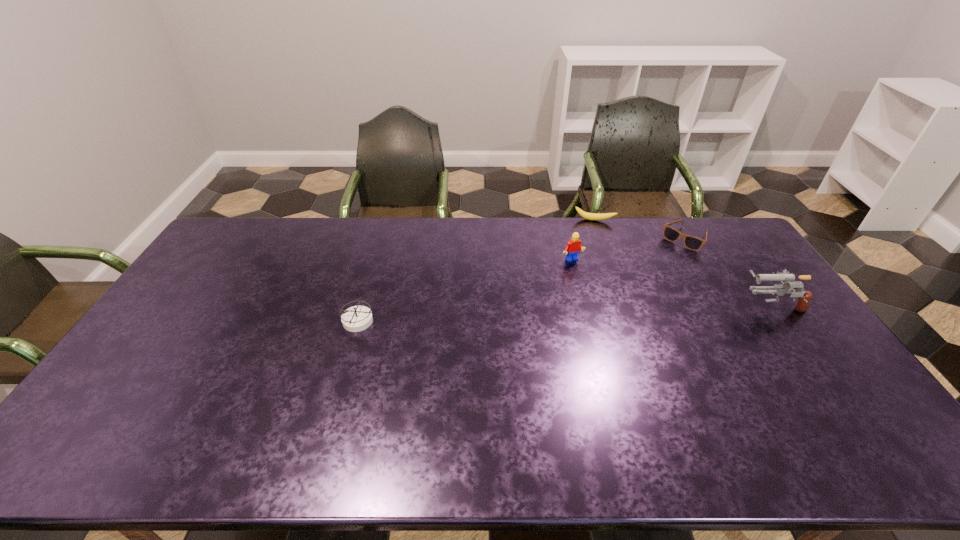
Identify which object is the closest to the compass. Please provide its 2D coordinates. Your answer should be formatted as a tuple, i.e. [(x, y)], where the tuple contains the x and y coordinates of a point satisfying the conditions above.

[(573, 247)]

Locate an element on the screen. free space in the image that satisfies the following two spatial constraints: 1. on the front side of the Lego; 2. at the barrel end of the gun is located at coordinates (584, 306).

You are a GUI agent. You are given a task and a screenshot of the screen. Output one action in this format:
    pyautogui.click(x=<x>, y=<y>)
    Task: Click on the blank area in the image that satisfies the following two spatial constraints: 1. on the front side of the sunglasses; 2. at the barrel end of the tallest object
    
    Given the screenshot: What is the action you would take?
    [x=725, y=306]

The image size is (960, 540). What are the coordinates of `blank space that satisfies the following two spatial constraints: 1. on the back side of the compass; 2. on the left side of the sunglasses` in the screenshot? It's located at (381, 239).

Where is `blank space that satisfies the following two spatial constraints: 1. on the back side of the leftmost object; 2. on the right side of the sunglasses`? The image size is (960, 540). blank space that satisfies the following two spatial constraints: 1. on the back side of the leftmost object; 2. on the right side of the sunglasses is located at coordinates (381, 239).